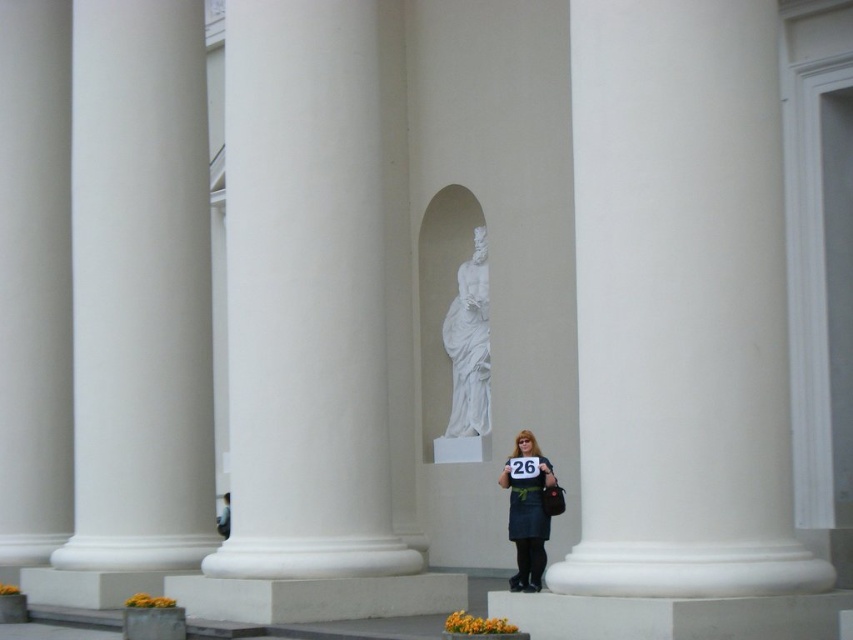
Between white smooth pillar at right and white marble statue at center, which one appears on the right side from the viewer's perspective?

Positioned to the right is white smooth pillar at right.

Who is taller, white smooth pillar at right or white marble statue at center?

white smooth pillar at right is taller.

Between point (741, 29) and point (465, 296), which one is positioned behind?

Positioned behind is point (465, 296).

This screenshot has height=640, width=853. What are the coordinates of `white smooth pillar at right` in the screenshot? It's located at (682, 305).

Is point (248, 388) positioned behind point (537, 460)?

No, it is not.

What do you see at coordinates (305, 294) in the screenshot?
I see `white smooth column at center` at bounding box center [305, 294].

The height and width of the screenshot is (640, 853). What are the coordinates of `white smooth column at center` in the screenshot? It's located at (305, 294).

Can you confirm if white smooth column at center is shorter than white marble statue at center?

In fact, white smooth column at center may be taller than white marble statue at center.

Between point (241, 164) and point (479, 356), which one is positioned in front?

Point (241, 164) is in front.

Who is more distant from viewer, (310, 362) or (460, 307)?

The point (460, 307) is behind.

This screenshot has width=853, height=640. I want to click on white smooth column at center, so click(x=305, y=294).